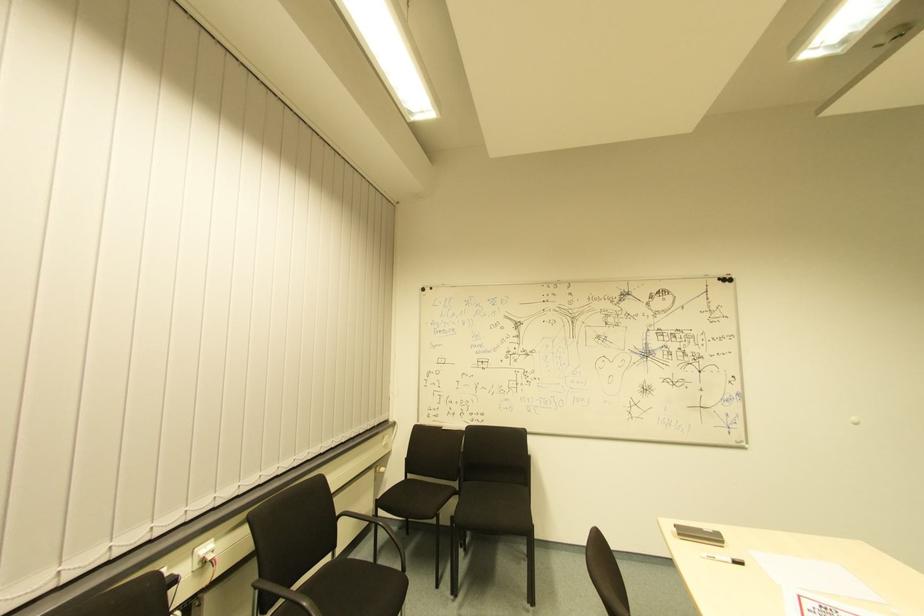
Describe the element at coordinates (208, 562) in the screenshot. I see `the white power socket` at that location.